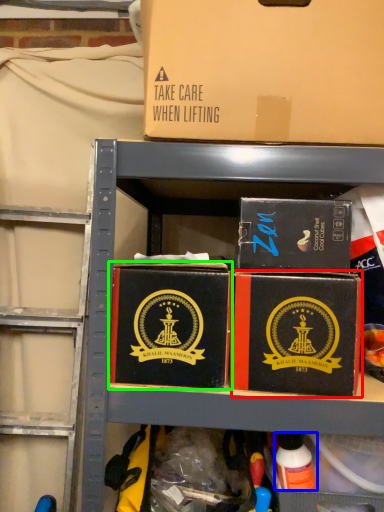
Question: Considering the real-world distances, which object is farthest from box (highlighted by a red box)? toy (highlighted by a blue box) or box (highlighted by a green box)?

Choices:
 (A) toy
 (B) box

Answer: (A)